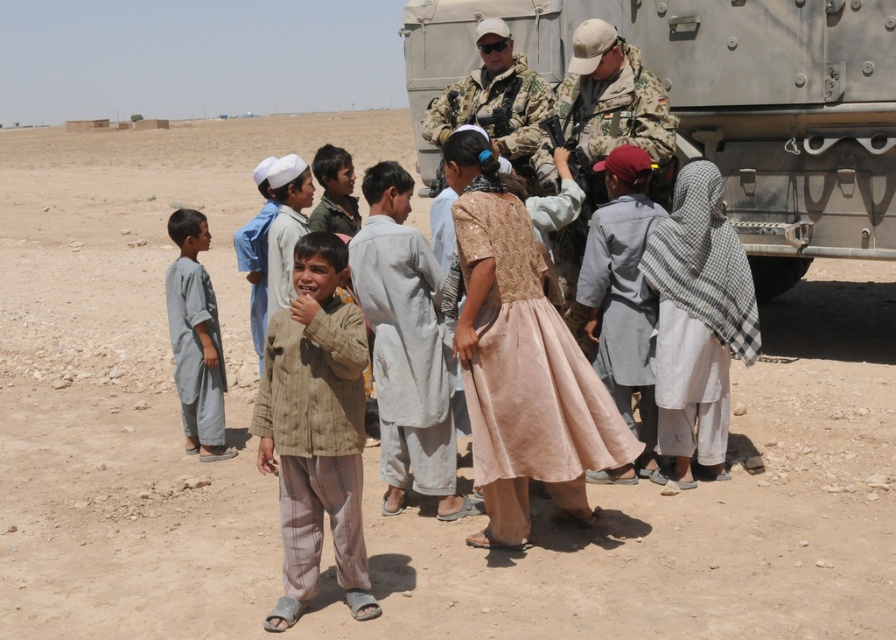
You are a photographer standing at point A. You want to take a photo of the military vehicle in the desert scene. There are two points marked in the image where you can position yourself. The first point is at coordinates point (444, 1) and the second is at point (184, 332). Which point would allow you to capture the military vehicle without any obstructions from the group of people?

Point (444, 1) is behind point (184, 332), so positioning yourself at point (184, 332) would place you in front of the group, allowing an unobstructed view of the military vehicle.

You are a photographer taking a picture of the beige fabric shirt at center and the gray cotton robe at left. Which one will be more visible in your photo?

The beige fabric shirt at center will be more visible in the photo because it is in front of the gray cotton robe at left, making it appear closer to the camera.

You are a photographer trying to capture a group photo of the beige fabric shirt at center and the camouflage uniform at center. Which person should you move closer to the camera to ensure both fit in the frame?

The beige fabric shirt at center has a lesser width compared to camouflage uniform at center, so you should move the camouflage uniform at center closer to the camera to ensure both fit in the frame.